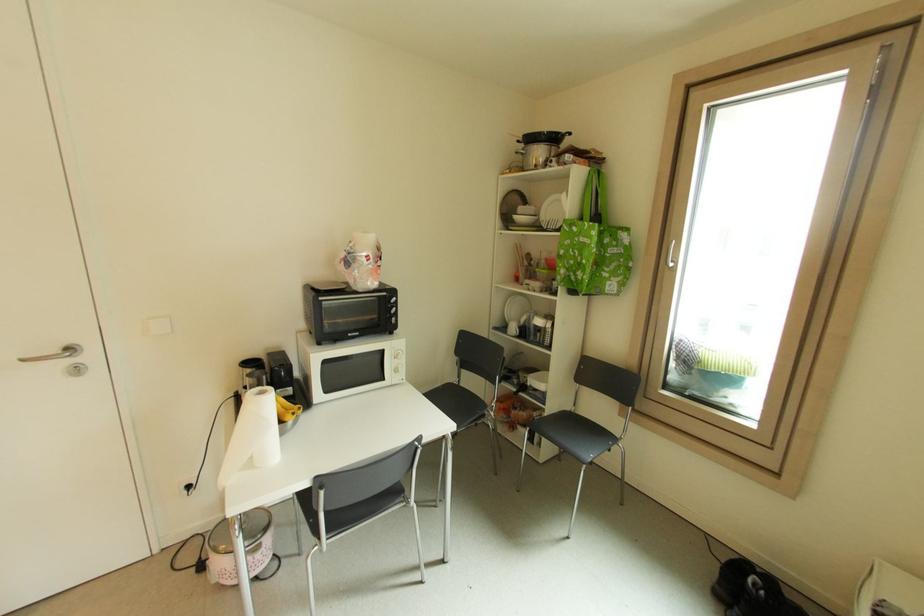
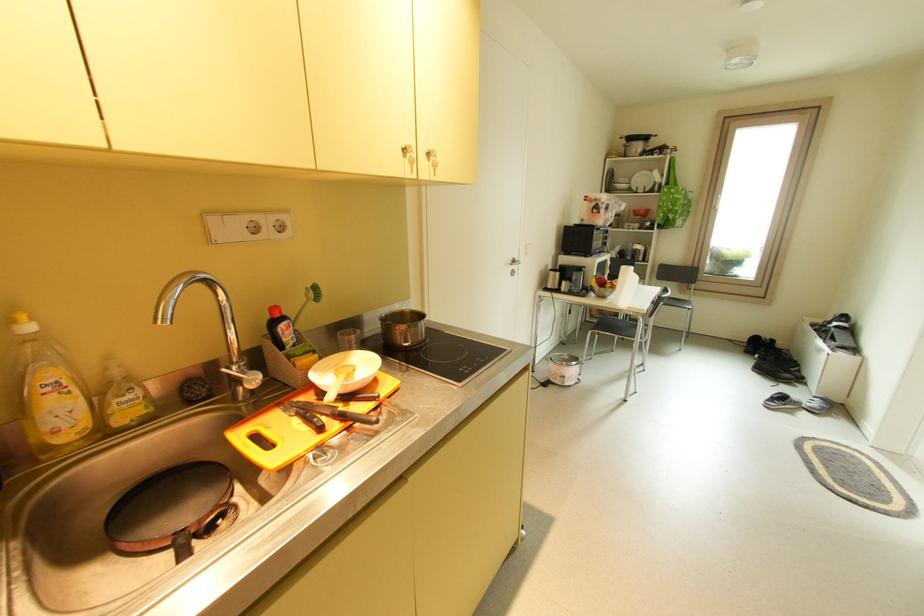
Question: Which direction would the cameraman need to move to produce the second image? Reply with the corresponding letter.

Choices:
 (A) Left
 (B) Right
 (C) Forward
 (D) Backward

Answer: (A)